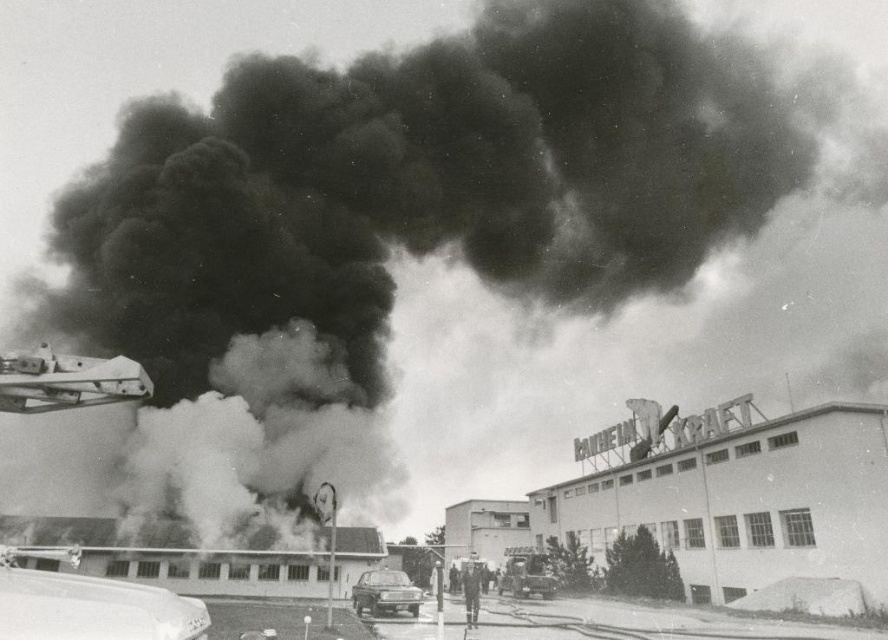
Question: Which object is the farthest from the shiny silver car at lower left?

Choices:
 (A) metallic silver car at center
 (B) silver metallic car at center

Answer: (A)

Question: Observing the image, what is the correct spatial positioning of silver metallic car at center in reference to metallic silver car at center?

Choices:
 (A) below
 (B) above

Answer: (B)

Question: Does shiny silver car at lower left come in front of silver metallic car at center?

Choices:
 (A) no
 (B) yes

Answer: (B)

Question: Which point is closer to the camera?

Choices:
 (A) silver metallic car at center
 (B) metallic silver car at center
 (C) shiny silver car at lower left

Answer: (C)

Question: Which object is farther from the camera taking this photo?

Choices:
 (A) shiny silver car at lower left
 (B) silver metallic car at center

Answer: (B)

Question: Is silver metallic car at center bigger than metallic silver car at center?

Choices:
 (A) no
 (B) yes

Answer: (A)